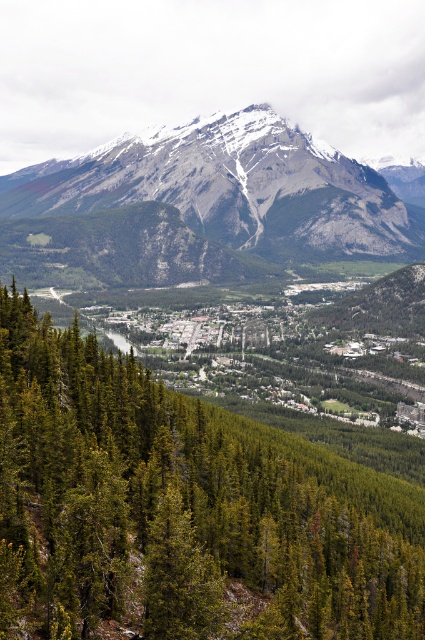
Question: Where is green matte tree at center located in relation to snowy granite mountain range at upper center in the image?

Choices:
 (A) below
 (B) above

Answer: (A)

Question: Observing the image, what is the correct spatial positioning of green matte tree at center in reference to snowy granite mountain range at upper center?

Choices:
 (A) left
 (B) right

Answer: (B)

Question: In this image, where is green matte tree at center located relative to snowy granite mountain range at upper center?

Choices:
 (A) right
 (B) left

Answer: (A)

Question: Among these objects, which one is nearest to the camera?

Choices:
 (A) green matte tree at center
 (B) snowy granite mountain range at upper center

Answer: (A)

Question: Which point is farther to the camera?

Choices:
 (A) (93, 378)
 (B) (238, 232)

Answer: (B)

Question: Which point is closer to the camera?

Choices:
 (A) (368, 220)
 (B) (39, 323)

Answer: (B)